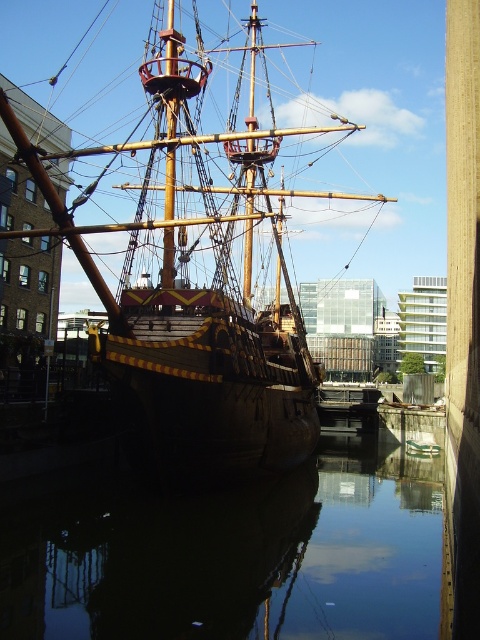
Question: Observing the image, what is the correct spatial positioning of wooden ship at center in reference to smooth dark water at center?

Choices:
 (A) right
 (B) left

Answer: (B)

Question: Which object is farther from the camera taking this photo?

Choices:
 (A) wooden ship at center
 (B) smooth dark water at center

Answer: (A)

Question: Is wooden ship at center positioned before smooth dark water at center?

Choices:
 (A) yes
 (B) no

Answer: (B)

Question: Is wooden ship at center wider than smooth dark water at center?

Choices:
 (A) no
 (B) yes

Answer: (A)